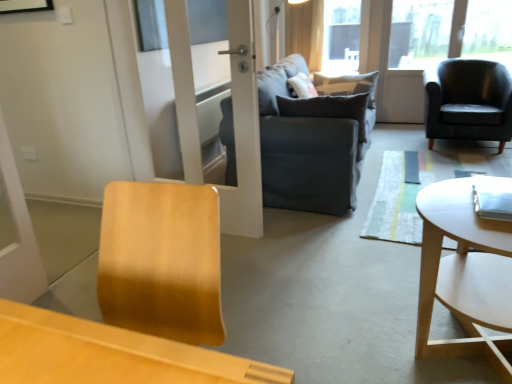
The image size is (512, 384). I want to click on dark gray fabric pillow at center, so click(327, 108).

The height and width of the screenshot is (384, 512). What do you see at coordinates (305, 31) in the screenshot?
I see `light beige fabric curtain at upper center` at bounding box center [305, 31].

Find the location of a particular element. white wood coffee table at right is located at coordinates 465,275.

Which is more to the left, matte black armchair at right or dark gray fabric couch at center?

Positioned to the left is dark gray fabric couch at center.

Are matte black armchair at right and dark gray fabric couch at center located far from each other?

matte black armchair at right is positioned a significant distance from dark gray fabric couch at center.

From the image's perspective, which is below, matte black armchair at right or dark gray fabric couch at center?

From the image's view, dark gray fabric couch at center is below.

Is matte black armchair at right oriented away from dark gray fabric couch at center?

No, matte black armchair at right's orientation is not away from dark gray fabric couch at center.

Does point (340, 16) come behind point (432, 75)?

Yes.

The image size is (512, 384). I want to click on window screen behind the matte black armchair at right, so tap(341, 35).

From the image's perspective, which is below, transparent glass window screen at upper center or matte black armchair at right?

matte black armchair at right is shown below in the image.

Based on the photo, considering their positions, is transparent glass window screen at upper center located in front of or behind matte black armchair at right?

Visually, transparent glass window screen at upper center is located behind matte black armchair at right.

Does white wood coffee table at right turn towards dark gray fabric pillow at center?

No, white wood coffee table at right does not turn towards dark gray fabric pillow at center.

Considering the positions of objects white wood coffee table at right and dark gray fabric pillow at center in the image provided, who is more to the right, white wood coffee table at right or dark gray fabric pillow at center?

From the viewer's perspective, white wood coffee table at right appears more on the right side.

Can you tell me how much white wood coffee table at right and dark gray fabric pillow at center differ in facing direction?

The facing directions of white wood coffee table at right and dark gray fabric pillow at center are 2.13 degrees apart.

Between white wood coffee table at right and dark gray fabric pillow at center, which one has more height?

white wood coffee table at right is taller.

Considering the points (350, 53) and (503, 331), which point is in front, point (350, 53) or point (503, 331)?

The point (503, 331) is more forward.

From the image's perspective, relative to white wood coffee table at right, is transparent glass window screen at upper center above or below?

Based on their image positions, transparent glass window screen at upper center is located above white wood coffee table at right.

Which object is more forward, transparent glass window screen at upper center or white wood coffee table at right?

white wood coffee table at right is in front.

From a real-world perspective, is dark gray fabric couch at center positioned above or below white wood coffee table at right?

Clearly, from a real-world perspective, dark gray fabric couch at center is above white wood coffee table at right.

Where is `coffee table that is in front of the dark gray fabric couch at center`? This screenshot has width=512, height=384. coffee table that is in front of the dark gray fabric couch at center is located at coordinates (465, 275).

Is dark gray fabric couch at center directly adjacent to white wood coffee table at right?

No, dark gray fabric couch at center is not next to white wood coffee table at right.

Is white wood coffee table at right surrounded by dark gray fabric couch at center?

No.

Which of these two, light beige fabric curtain at upper center or dark gray fabric couch at center, is bigger?

dark gray fabric couch at center.

At what (x,y) coordinates should I click in order to perform the action: click on studio couch below the light beige fabric curtain at upper center (from a real-world perspective). Please return your answer as a coordinate pair (x, y). The height and width of the screenshot is (384, 512). Looking at the image, I should click on (312, 141).

Is light beige fabric curtain at upper center positioned in front of dark gray fabric couch at center?

No, it is not.

Is dark gray fabric pillow at center in contact with dark gray fabric couch at center?

No, dark gray fabric pillow at center is not touching dark gray fabric couch at center.

From the picture: Which is behind, dark gray fabric pillow at center or dark gray fabric couch at center?

dark gray fabric pillow at center.

This screenshot has height=384, width=512. Find the location of `studio couch lying in front of the dark gray fabric pillow at center`. studio couch lying in front of the dark gray fabric pillow at center is located at coordinates (312, 141).

At what (x,y) coordinates should I click in order to perform the action: click on chair behind the dark gray fabric couch at center. Please return your answer as a coordinate pair (x, y). Looking at the image, I should click on tap(469, 101).

Locate an element on the screen. The width and height of the screenshot is (512, 384). chair in front of the transparent glass window screen at upper center is located at coordinates (469, 101).

Which object lies nearer to the anchor point dark gray fabric pillow at center, dark gray fabric couch at center or matte black armchair at right?

dark gray fabric couch at center lies closer to dark gray fabric pillow at center than the other object.

Considering their positions, is transparent glass window screen at upper center positioned closer to dark gray fabric couch at center than light beige fabric curtain at upper center?

The object closer to dark gray fabric couch at center is light beige fabric curtain at upper center.

Based on their spatial positions, is matte black armchair at right or dark gray fabric pillow at center closer to light beige fabric curtain at upper center?

matte black armchair at right is closer to light beige fabric curtain at upper center.

Considering their positions, is white wood coffee table at right positioned closer to dark gray fabric couch at center than dark gray fabric pillow at center?

The object closer to dark gray fabric couch at center is dark gray fabric pillow at center.

From the picture: Which object lies further to the anchor point dark gray fabric couch at center, dark gray fabric pillow at center or transparent glass window screen at upper center?

transparent glass window screen at upper center is further to dark gray fabric couch at center.

Based on their spatial positions, is dark gray fabric pillow at center or dark gray fabric couch at center further from light beige fabric curtain at upper center?

dark gray fabric pillow at center lies further to light beige fabric curtain at upper center than the other object.

Estimate the real-world distances between objects in this image. Which object is further from dark gray fabric couch at center, dark gray fabric pillow at center or matte black armchair at right?

matte black armchair at right is positioned further to the anchor dark gray fabric couch at center.

Looking at the image, which one is located further to transparent glass window screen at upper center, light beige fabric curtain at upper center or dark gray fabric couch at center?

dark gray fabric couch at center is further to transparent glass window screen at upper center.

The height and width of the screenshot is (384, 512). I want to click on studio couch located between white wood coffee table at right and transparent glass window screen at upper center in the depth direction, so click(312, 141).

Locate an element on the screen. pillow situated between dark gray fabric couch at center and matte black armchair at right from left to right is located at coordinates (327, 108).

The height and width of the screenshot is (384, 512). What are the coordinates of `studio couch between white wood coffee table at right and dark gray fabric pillow at center from front to back` in the screenshot? It's located at (312, 141).

Where is `window screen between light beige fabric curtain at upper center and matte black armchair at right`? The width and height of the screenshot is (512, 384). window screen between light beige fabric curtain at upper center and matte black armchair at right is located at coordinates (341, 35).